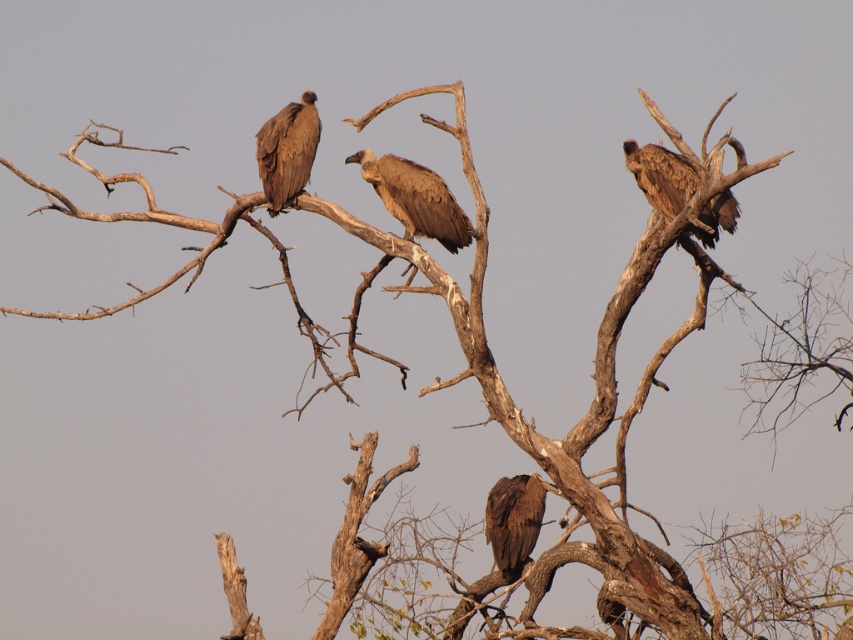
Looking at this image, you are an ornithologist studying the positions of birds in a tree. You observe a brown feathered eagle at upper right. Based on its coordinates, can you determine if it is positioned higher than the other vultures on the tree?

The brown feathered eagle at upper right is located at point (660, 177), which indicates its position relative to the tree. Since the coordinates are given without specific reference to the other vultures, I cannot definitively determine if it is higher than the others without additional spatial data comparing its position to theirs.

You are standing in front of the tree with the vultures. You notice two points marked on the branches. The first point is at coordinate point (x=722, y=221) and the second point is at coordinate point (x=283, y=195). Which point is closer to you?

Point (x=722, y=221) is in front of point (x=283, y=195), so it is closer to you.

From the picture: You are a birdwatcher observing the three vultures on the leafless tree. You notice a specific point labeled as point (x=287, y=150). Which vulture does this point correspond to?

The point (x=287, y=150) corresponds to the brown feathered vulture at upper left.